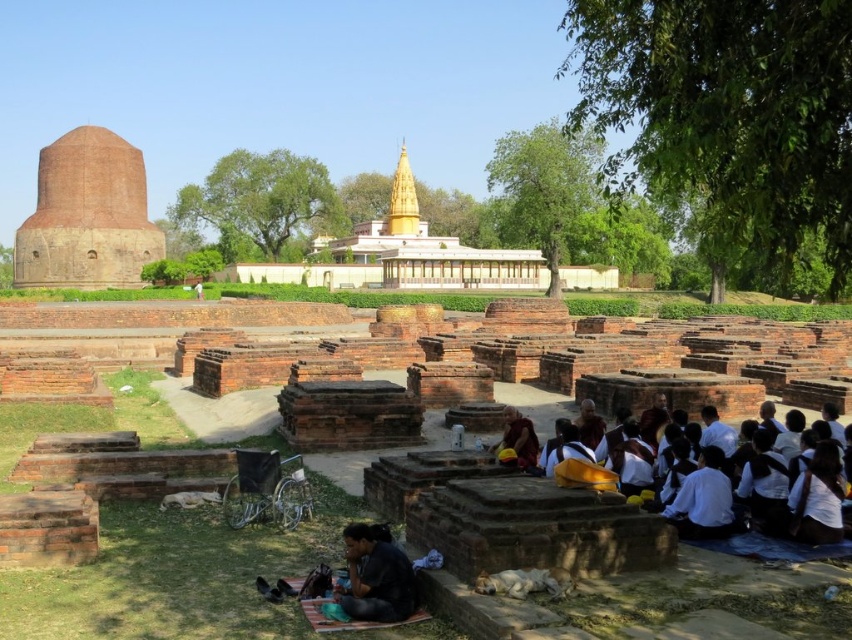
Question: Which is farther from the golden robe at center?

Choices:
 (A) brick stupa at left
 (B) black fabric at lower center

Answer: (A)

Question: Does black fabric at lower center have a larger size compared to golden robe at center?

Choices:
 (A) yes
 (B) no

Answer: (B)

Question: Which point appears farthest from the camera in this image?

Choices:
 (A) (514, 456)
 (B) (106, 273)
 (C) (367, 579)

Answer: (B)

Question: Can you confirm if brick stupa at left is positioned to the right of black fabric at lower center?

Choices:
 (A) no
 (B) yes

Answer: (A)

Question: Based on their relative distances, which object is nearer to the black fabric at lower center?

Choices:
 (A) brick stupa at left
 (B) golden robe at center

Answer: (B)

Question: Can you confirm if black fabric at lower center is positioned to the left of golden robe at center?

Choices:
 (A) yes
 (B) no

Answer: (A)